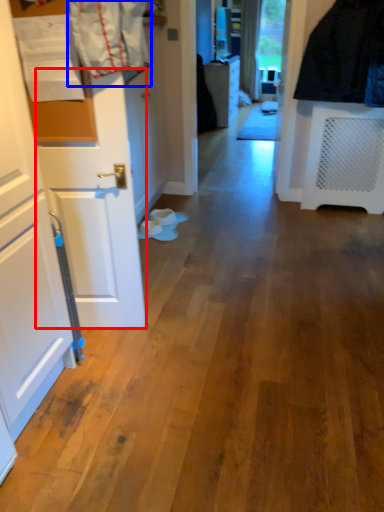
Question: Which of the following is the closest to the observer, door (highlighted by a red box) or laundry (highlighted by a blue box)?

Choices:
 (A) door
 (B) laundry

Answer: (B)